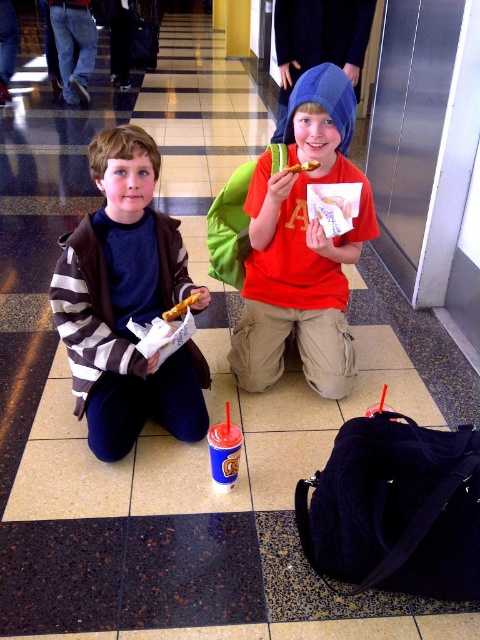
You are a photographer trying to capture the striped fabric jacket at left and the yellow matte french fry at center in the same frame. Based on their positions, which object should you focus on first to ensure both are in the shot?

The striped fabric jacket at left is located below the yellow matte french fry at center, so you should focus on the yellow matte french fry at center first to ensure both objects are within the frame.

You are a photographer trying to capture a closeup of the yellow matte french fry at center without the red matte shirt at center blocking the view. Is it possible to do so based on their sizes?

The red matte shirt at center is bigger than the yellow matte french fry at center, so it might block the view. To capture the french fry without the shirt blocking, you need to adjust the angle or move closer to focus solely on the fry.